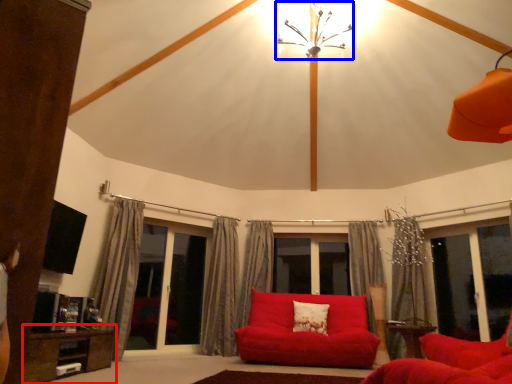
Question: Which of the following is the farthest to the observer, table (highlighted by a red box) or light fixture (highlighted by a blue box)?

Choices:
 (A) table
 (B) light fixture

Answer: (B)